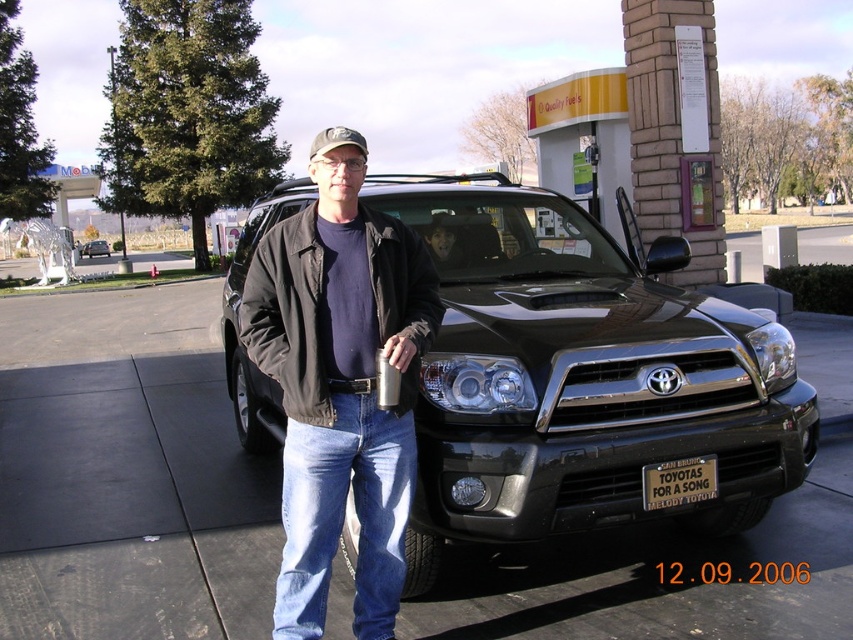
Based on the photo, you are a photographer trying to capture a clear shot of the metallic silver license plate at front center while avoiding the black metallic suv at center. Based on their positions, is it possible to frame the license plate without the SUV blocking it?

The black metallic suv at center is positioned on the left side of the metallic silver license plate at front center, so if you move to the right side of the SUV, you can frame the license plate without obstruction.

You are a delivery driver who needs to park your truck next to the black metallic suv at center and the black matte suv at center. If your truck is 2.5 meters wide, can you park between them without overlapping?

The black metallic suv at center is narrower than the black matte suv at center. However, the total combined width of both SUVs would depend on their exact placement. Since the question only provides individual widths and not the distance between them, it is impossible to determine if there is enough space between them for the 2.5 meter truck without additional information about their separation distance.